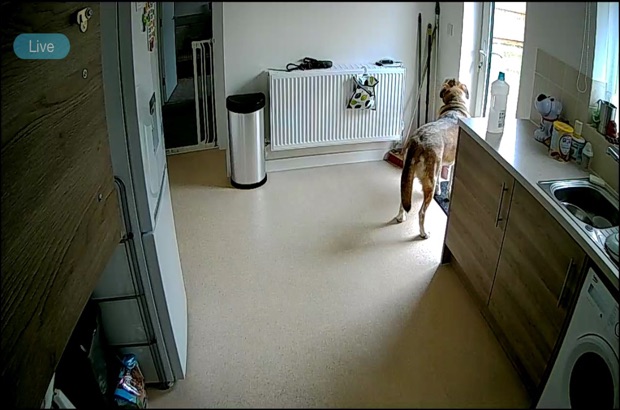
This screenshot has height=410, width=620. I want to click on sink, so click(583, 213).